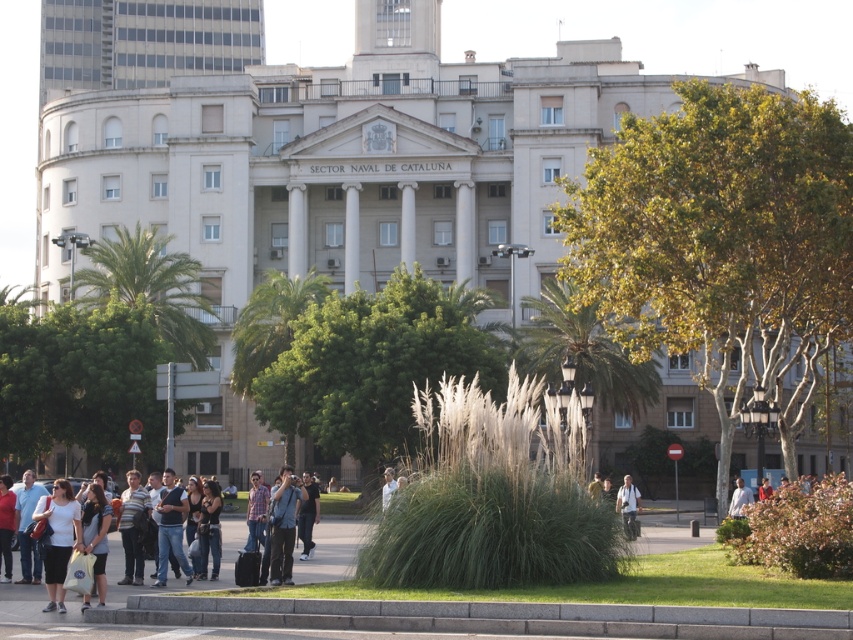
Who is higher up, light brown backpack at lower right or white cotton shirt at lower right?

light brown backpack at lower right is above.

Which is behind, point (627, 508) or point (735, 481)?

The point (735, 481) is more distant.

Is point (628, 490) farther from camera compared to point (730, 502)?

No, it is not.

Locate an element on the screen. The width and height of the screenshot is (853, 640). light brown backpack at lower right is located at coordinates (628, 506).

Does white cotton shirt at lower right appear on the right side of yellow fabric shirt at center?

Correct, you'll find white cotton shirt at lower right to the right of yellow fabric shirt at center.

Which is in front, point (740, 508) or point (593, 493)?

Point (593, 493) is in front.

You are a GUI agent. You are given a task and a screenshot of the screen. Output one action in this format:
    pyautogui.click(x=<x>, y=<y>)
    Task: Click on the white cotton shirt at lower right
    
    Given the screenshot: What is the action you would take?
    pyautogui.click(x=740, y=499)

Is light brown backpack at lower right smaller than light brown leather jacket at center?

No.

Does light brown backpack at lower right have a lesser width compared to light brown leather jacket at center?

Incorrect, light brown backpack at lower right's width is not less than light brown leather jacket at center's.

You are a GUI agent. You are given a task and a screenshot of the screen. Output one action in this format:
    pyautogui.click(x=<x>, y=<y>)
    Task: Click on the light brown backpack at lower right
    Image resolution: width=853 pixels, height=640 pixels.
    Given the screenshot: What is the action you would take?
    pyautogui.click(x=628, y=506)